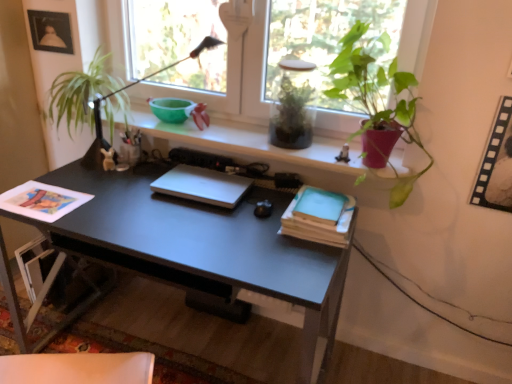
Question: Considering the positions of black matte desk at center and light blue paper at center right, which ranks as the 2th paperback book in top-to-bottom order, in the image, is black matte desk at center wider or thinner than light blue paper at center right, which ranks as the 2th paperback book in top-to-bottom order,?

Choices:
 (A) thin
 (B) wide

Answer: (B)

Question: Is black matte desk at center taller or shorter than light blue paper at center right, which ranks as the 2th paperback book in top-to-bottom order?

Choices:
 (A) short
 (B) tall

Answer: (B)

Question: Which is farther from the matte black picture frame at upper left, the 2th picture frame positioned from the right?

Choices:
 (A) light blue matte paper at center right, the second paperback book when ordered from bottom to top
 (B) green leafy plant at left
 (C) light blue paper at center right, the 1th paperback book ordered from the bottom
 (D) green matte plant at upper right, which is counted as the second houseplant, starting from the left
 (E) black matte desk at center

Answer: (C)

Question: Which object is positioned closest to the white matte laptop at center?

Choices:
 (A) matte white shelf at upper center
 (B) light blue matte paper at center right, the second paperback book when ordered from bottom to top
 (C) black matte desk at center
 (D) green leafy plant at left
 (E) green matte plant at upper right, which is counted as the second houseplant, starting from the left

Answer: (C)